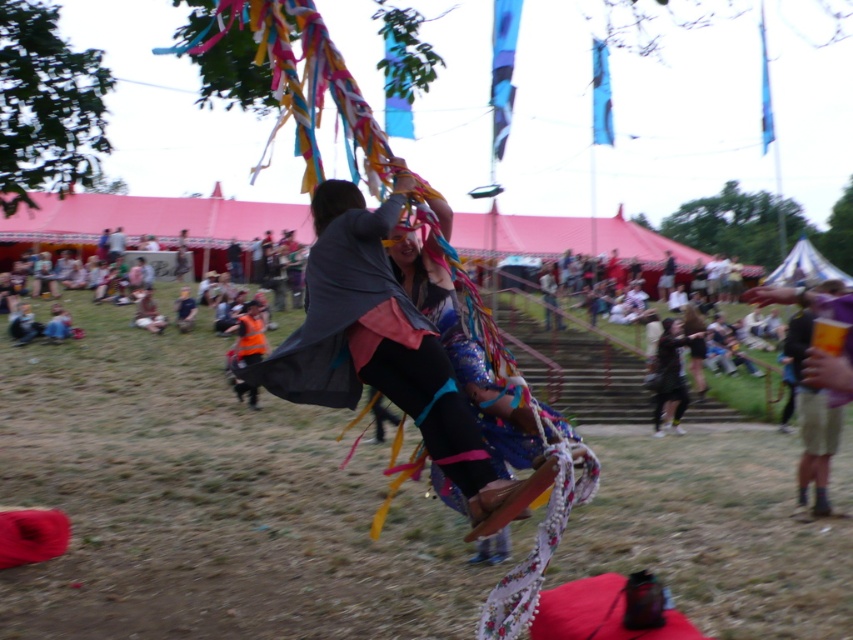
Question: Which object is the farthest from the orange reflective vest at center?

Choices:
 (A) shiny metallic cape at center
 (B) black fabric pants at center

Answer: (A)

Question: Which object appears farthest from the camera in this image?

Choices:
 (A) black fabric pants at center
 (B) shiny metallic cape at center

Answer: (A)

Question: Can you confirm if shiny metallic cape at center is positioned below orange reflective vest at center?

Choices:
 (A) no
 (B) yes

Answer: (A)

Question: Among these objects, which one is farthest from the camera?

Choices:
 (A) shiny metallic cape at center
 (B) orange reflective vest at center

Answer: (B)

Question: From the image, what is the correct spatial relationship of shiny metallic cape at center in relation to black fabric pants at center?

Choices:
 (A) left
 (B) right

Answer: (A)

Question: Is black fabric pants at center thinner than orange reflective vest at center?

Choices:
 (A) no
 (B) yes

Answer: (A)